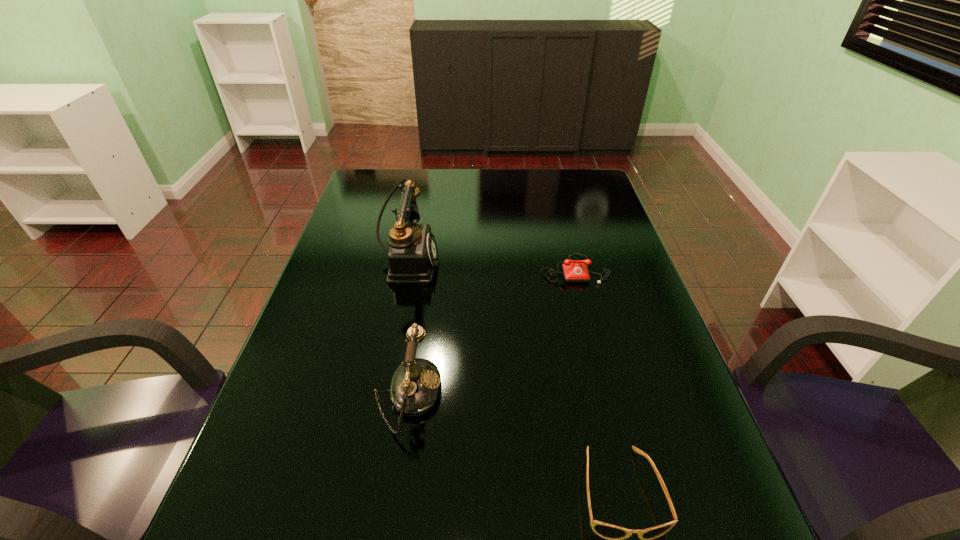
Identify which object is the second closest to the second tallest telephone. Please provide its 2D coordinates. Your answer should be formatted as a tuple, i.e. [(x, y)], where the tuple contains the x and y coordinates of a point satisfying the conditions above.

[(615, 534)]

At what (x,y) coordinates should I click in order to perform the action: click on telephone that is the closest to the tallest telephone. Please return your answer as a coordinate pair (x, y). The image size is (960, 540). Looking at the image, I should click on (415, 387).

Identify the location of telephone identified as the closest to the rightmost telephone. The width and height of the screenshot is (960, 540). (412, 255).

What are the coordinates of `blank space that satisfies the following two spatial constraints: 1. on the dial of the shortest telephone; 2. on the dial of the nearest telephone` in the screenshot? It's located at (605, 395).

Where is `vacant space that satisfies the following two spatial constraints: 1. on the dial of the shortest telephone; 2. on the dial of the nearest telephone`? This screenshot has width=960, height=540. vacant space that satisfies the following two spatial constraints: 1. on the dial of the shortest telephone; 2. on the dial of the nearest telephone is located at coordinates (605, 395).

Find the location of a particular element. Image resolution: width=960 pixels, height=540 pixels. blank space that satisfies the following two spatial constraints: 1. on the dial of the rightmost telephone; 2. on the dial of the second shortest telephone is located at coordinates (605, 395).